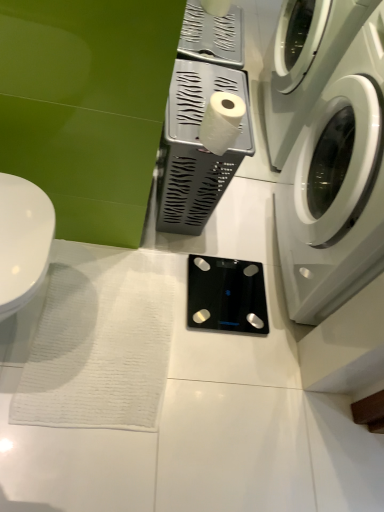
In order to click on unoccupied region to the right of black glass scale at center, acting as the 2th appliance starting from the top in this screenshot , I will do `click(281, 333)`.